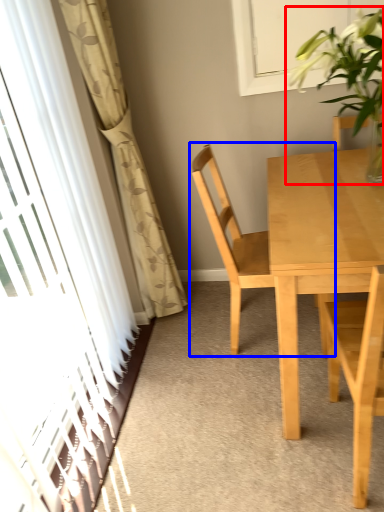
Question: Which point is further to the camera, houseplant (highlighted by a red box) or chair (highlighted by a blue box)?

Choices:
 (A) houseplant
 (B) chair

Answer: (B)